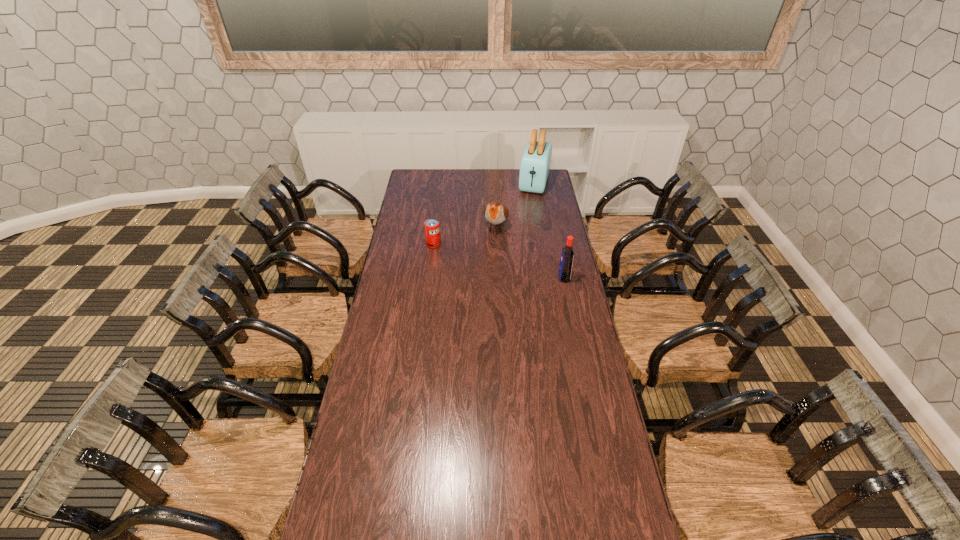
Locate an element on the screen. The image size is (960, 540). free space that satisfies the following two spatial constraints: 1. on the front side of the third nearest object; 2. on the front and back of the vodka is located at coordinates (498, 278).